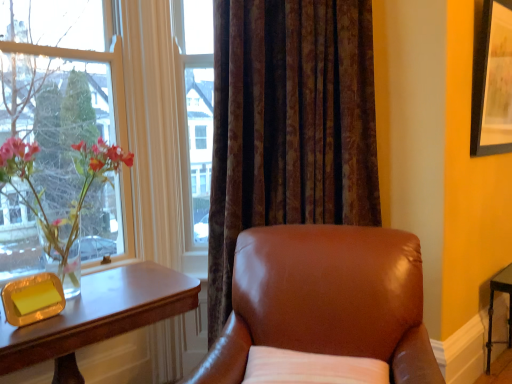
Question: From the image's perspective, is translucent glass vase at left above or below clear glass vase at left?

Choices:
 (A) below
 (B) above

Answer: (A)

Question: In the image, is translucent glass vase at left on the left side or the right side of clear glass vase at left?

Choices:
 (A) right
 (B) left

Answer: (A)

Question: Which object is positioned farthest from the wooden table at left?

Choices:
 (A) white fabric pillow at lower center
 (B) clear glass vase at left
 (C) translucent glass vase at left
 (D) brown leather chair at center
 (E) brown textured curtain at center

Answer: (E)

Question: Based on their relative distances, which object is farther from the brown textured curtain at center?

Choices:
 (A) dark brown wood side table at lower right
 (B) white fabric pillow at lower center
 (C) wooden table at left
 (D) black matte picture frame at upper right
 (E) brown leather chair at center

Answer: (A)